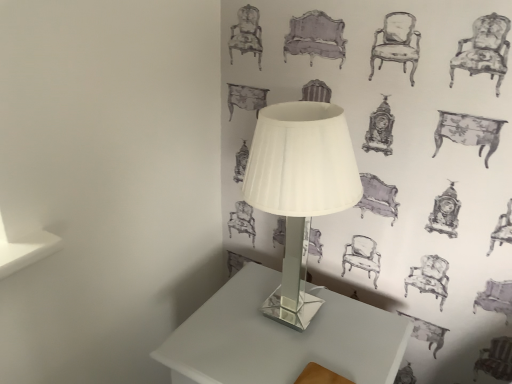
Locate an element on the screen. free location in front of white glass lamp at center is located at coordinates (289, 365).